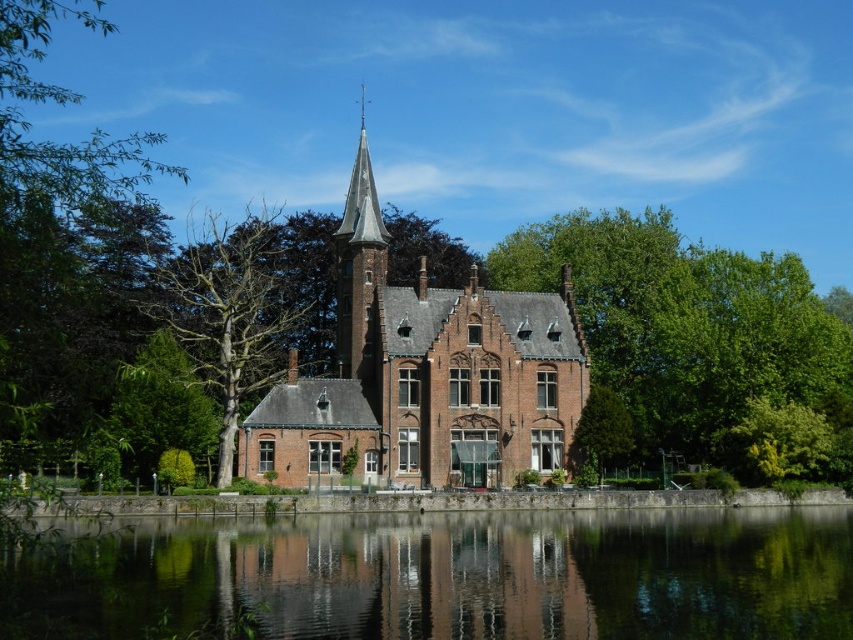
Question: Is brick house at center to the right of green leafy tree at right from the viewer's perspective?

Choices:
 (A) no
 (B) yes

Answer: (A)

Question: Which point is farther to the camera?

Choices:
 (A) (337, 262)
 (B) (524, 305)
 (C) (682, 426)
 (D) (236, 541)

Answer: (A)

Question: Which object is the closest to the green leafy tree at right?

Choices:
 (A) bare wood tree at left
 (B) brick house at center

Answer: (B)

Question: Among these points, which one is farthest from the camera?

Choices:
 (A) (553, 637)
 (B) (352, 264)

Answer: (B)

Question: Is transparent glass water at center further to the viewer compared to brick house at center?

Choices:
 (A) yes
 (B) no

Answer: (B)

Question: Can you confirm if transparent glass water at center is wider than green leafy tree at right?

Choices:
 (A) yes
 (B) no

Answer: (A)